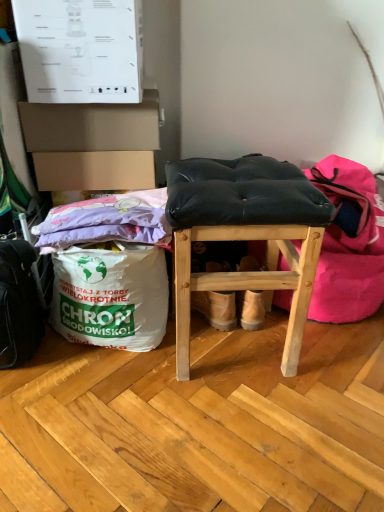
Question: Is black leather messenger bag at lower left wider than black leather stool at center?

Choices:
 (A) no
 (B) yes

Answer: (A)

Question: Does black leather messenger bag at lower left have a greater height compared to black leather stool at center?

Choices:
 (A) no
 (B) yes

Answer: (A)

Question: Is black leather messenger bag at lower left thinner than black leather stool at center?

Choices:
 (A) no
 (B) yes

Answer: (B)

Question: Is black leather messenger bag at lower left positioned before black leather stool at center?

Choices:
 (A) no
 (B) yes

Answer: (A)

Question: Is black leather messenger bag at lower left shorter than black leather stool at center?

Choices:
 (A) yes
 (B) no

Answer: (A)

Question: Is black leather messenger bag at lower left far from black leather stool at center?

Choices:
 (A) yes
 (B) no

Answer: (B)

Question: From a real-world perspective, does white paper grocery bag at lower left sit lower than black leather messenger bag at lower left?

Choices:
 (A) no
 (B) yes

Answer: (B)

Question: Is white paper grocery bag at lower left oriented away from black leather messenger bag at lower left?

Choices:
 (A) no
 (B) yes

Answer: (A)

Question: Can you confirm if white paper grocery bag at lower left is smaller than black leather messenger bag at lower left?

Choices:
 (A) yes
 (B) no

Answer: (B)

Question: Considering the relative sizes of white paper grocery bag at lower left and black leather messenger bag at lower left in the image provided, is white paper grocery bag at lower left bigger than black leather messenger bag at lower left?

Choices:
 (A) yes
 (B) no

Answer: (A)

Question: Is white paper grocery bag at lower left positioned in front of black leather messenger bag at lower left?

Choices:
 (A) no
 (B) yes

Answer: (A)

Question: From the image's perspective, would you say white paper grocery bag at lower left is shown under black leather messenger bag at lower left?

Choices:
 (A) no
 (B) yes

Answer: (A)

Question: From a real-world perspective, does black leather stool at center stand above black fabric bean bag chair at center?

Choices:
 (A) yes
 (B) no

Answer: (A)